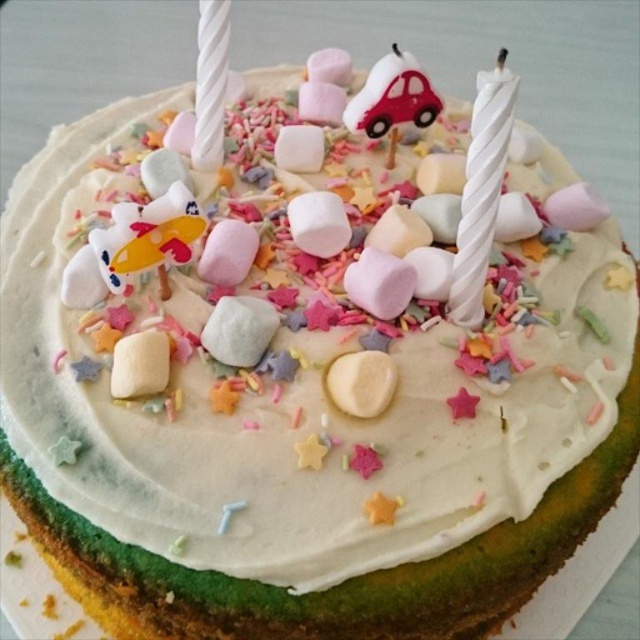
You are a guest at a birthday party and want to blow out the tallest candle on the cake. Which candle should you choose between the white twisted candle at upper right and the white twisted candle at upper center?

The white twisted candle at upper right is much taller than the white twisted candle at upper center, so you should choose the white twisted candle at upper right to blow out.

You are a baker who needs to choose the thinnest candle for a special decoration. You have two options on the cake surface, the white twisted candle at upper right and the white twisted candle at upper center. Which candle should you pick?

The white twisted candle at upper right is thinner than the white twisted candle at upper center, so you should pick the white twisted candle at upper right for the special decoration.

You are a birthday guest standing in front of the cake. You want to blow out the white twisted candle at upper right. Where should you aim to blow towards?

You should aim to blow towards the point at coordinates 0.298 on the x axis and 0.753 on the y axis where the white twisted candle at upper right is located.